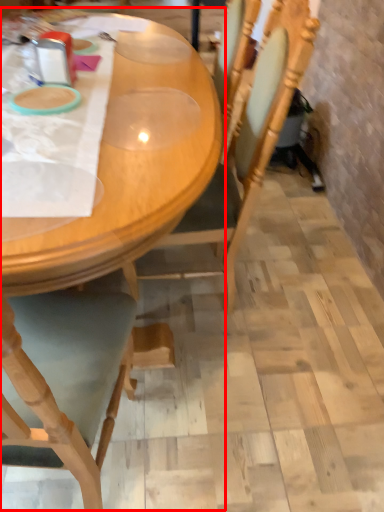
Question: From the image's perspective, where is table (annotated by the red box) located relative to chair?

Choices:
 (A) above
 (B) below

Answer: (A)